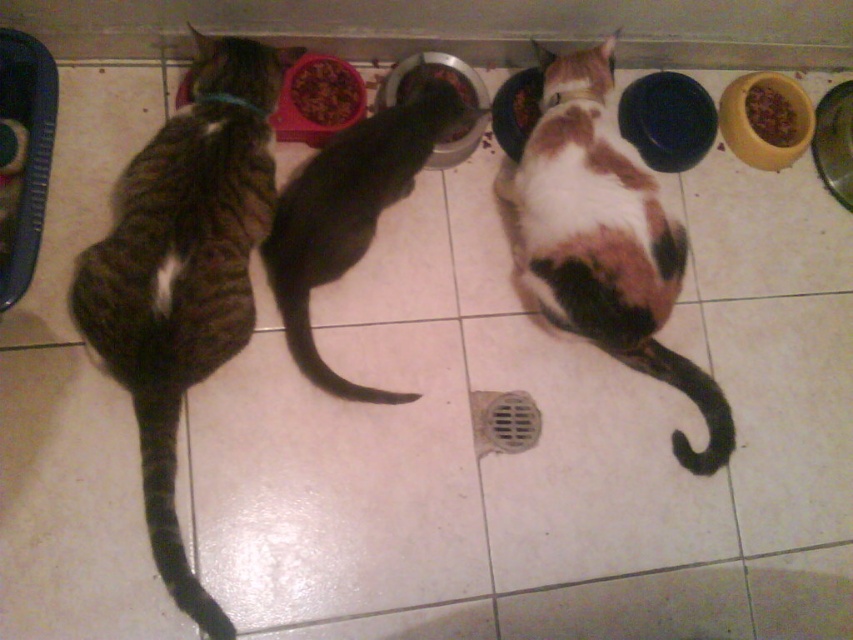
You are a cat owner who wants to place a new toy between the calico fur cat at center and the black glossy cat at center. Based on their positions, which cat will the toy be closer to?

The toy placed between the calico fur cat at center and the black glossy cat at center will be closer to the calico fur cat at center since it is positioned in front of the black glossy cat at center.

You are a cat owner who wants to ensure your cats have enough food. You notice the brown textured food at center and the brown matte food at upper right. Which food pile is taller?

The brown textured food at center is taller than the brown matte food at upper right.

You are a cat owner who wants to ensure your cats have enough space to eat comfortably. Given that the minimum recommended distance between cat bowls is 36 inches for cats to avoid territorial disputes, does the distance between the striped fur cat at left and the brown matte food at upper right meet this requirement?

The striped fur cat at left and the brown matte food at upper right are 38.98 inches apart from each other, which exceeds the minimum recommended distance of 36 inches. Therefore, the spacing between the striped fur cat at left and the brown matte food at upper right meets the requirement.